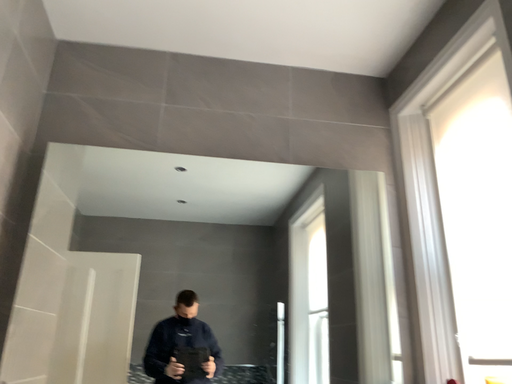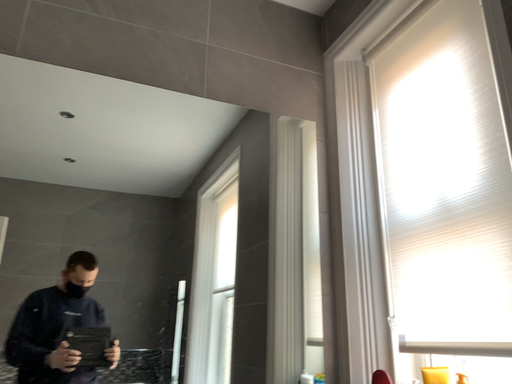
Question: Which way did the camera rotate in the video?

Choices:
 (A) rotated left
 (B) rotated right

Answer: (B)